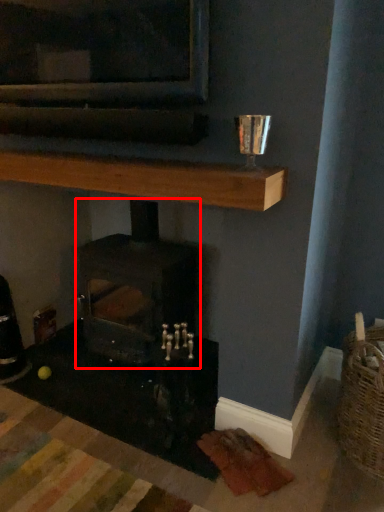
Question: Considering the relative positions of wood burning stove (annotated by the red box) and shelf in the image provided, where is wood burning stove (annotated by the red box) located with respect to the staircase?

Choices:
 (A) left
 (B) right

Answer: (B)